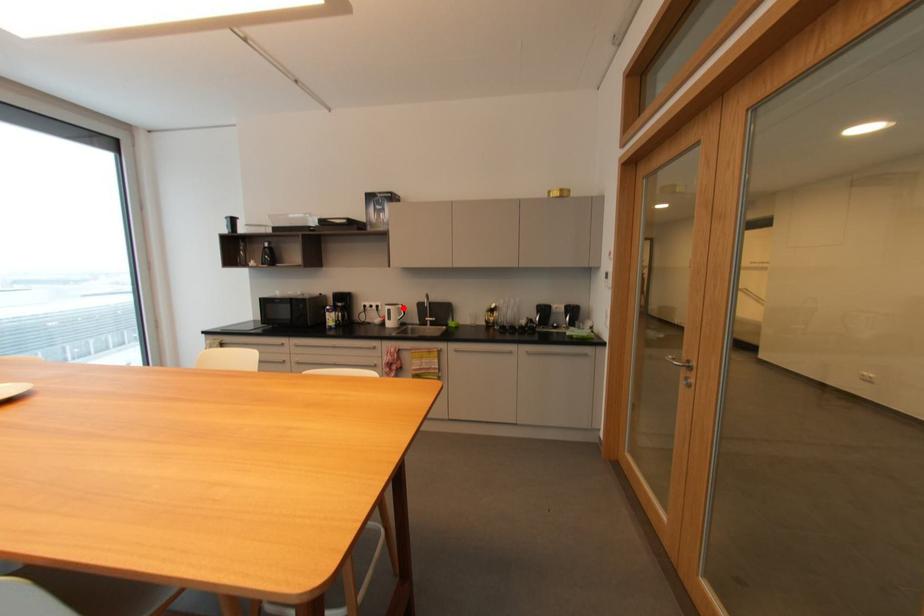
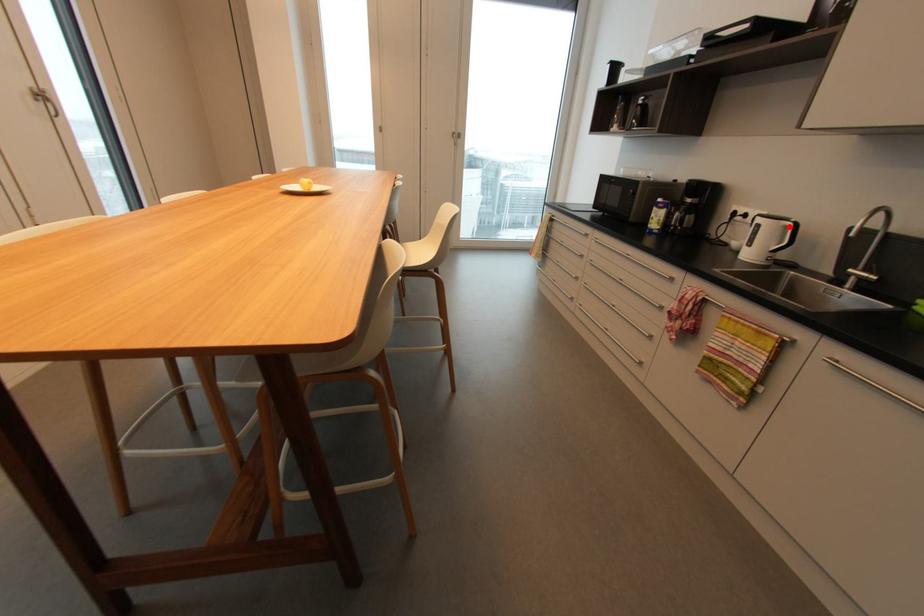
I am providing you with two images of the same scene from different viewpoints. A red point is marked on the first image and another point is marked on the second image. Are the points marked in image1 and image2 representing the same 3D position?

Yes